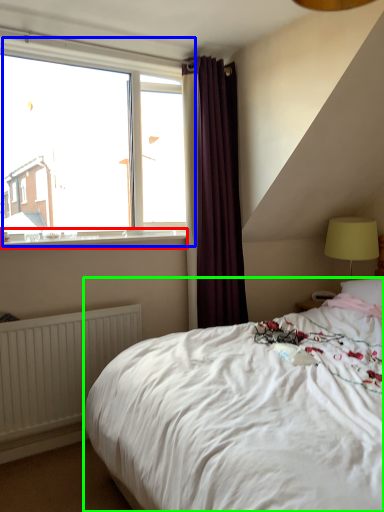
Question: Which object is the closest to the window sill (highlighted by a red box)? Choose among these: window (highlighted by a blue box) or bed (highlighted by a green box).

Choices:
 (A) window
 (B) bed

Answer: (A)